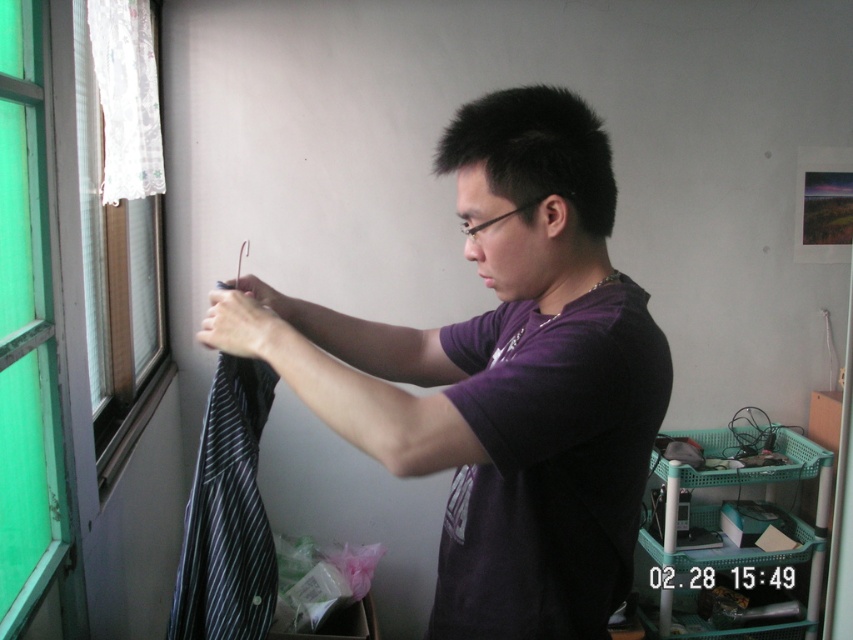
You are a guest in this room and want to open the green glass window at left to let some fresh air in. However, you notice the white lace curtain at upper left. Can you open the window without moving the curtain?

The green glass window at left is located below the white lace curtain at upper left, so you can open the window without moving the curtain because the curtain is above it.

You are a person who wants to hang a picture frame on the wall. You see the green glass window at left and the white lace curtain at upper left. Which object is taller and would require a higher hook to hang something above it?

The green glass window at left is taller than the white lace curtain at upper left, so you would need a higher hook to hang something above the green glass window at left.

You are a person trying to find the best spot to hang a new picture frame. You see the white lace curtain at left and the white lace curtain at upper left. Which curtain is closer to you?

The white lace curtain at left is closer to you than the white lace curtain at upper left.